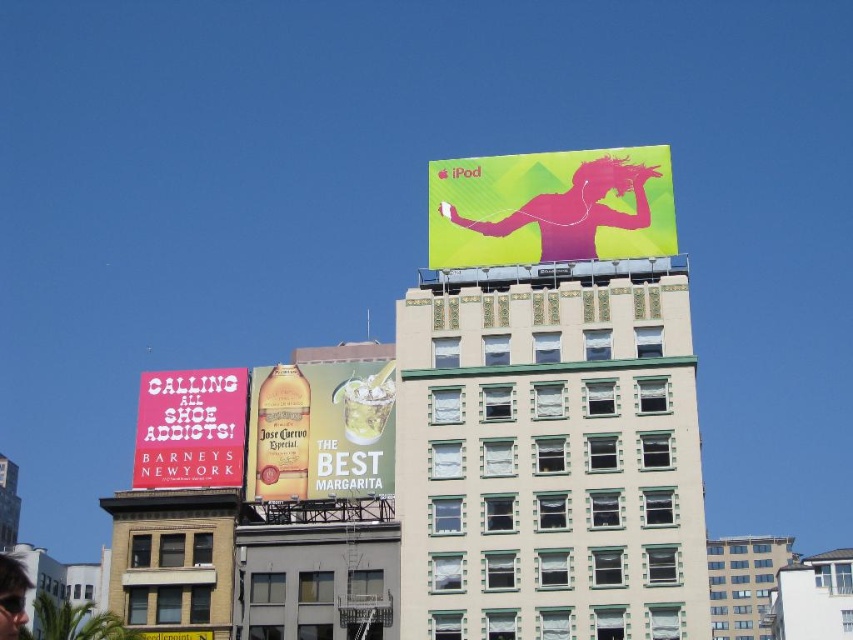
Question: Which point is farther from the camera taking this photo?

Choices:
 (A) (152, 577)
 (B) (519, 220)
 (C) (154, 388)

Answer: (C)

Question: Considering the real-world distances, which object is closest to the matte gold bottle at center?

Choices:
 (A) white concrete building at upper center
 (B) shiny black sunglasses at lower left

Answer: (B)

Question: Based on their relative distances, which object is farther from the pink matte signboard at upper left?

Choices:
 (A) white concrete building at upper center
 (B) pink matte ipod at upper center
 (C) white concrete building at center
 (D) beige brick building at lower left

Answer: (C)

Question: Is the position of pink matte signboard at upper left less distant than that of white concrete building at center?

Choices:
 (A) no
 (B) yes

Answer: (A)

Question: Does matte gold bottle at center appear on the left side of beige brick building at lower left?

Choices:
 (A) yes
 (B) no

Answer: (B)

Question: Does beige brick building at lower left have a lesser width compared to white concrete building at center?

Choices:
 (A) no
 (B) yes

Answer: (B)